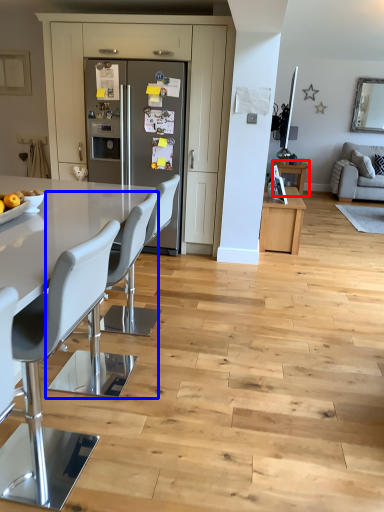
Question: Which object is further to the camera taking this photo, table (highlighted by a red box) or chair (highlighted by a blue box)?

Choices:
 (A) table
 (B) chair

Answer: (A)